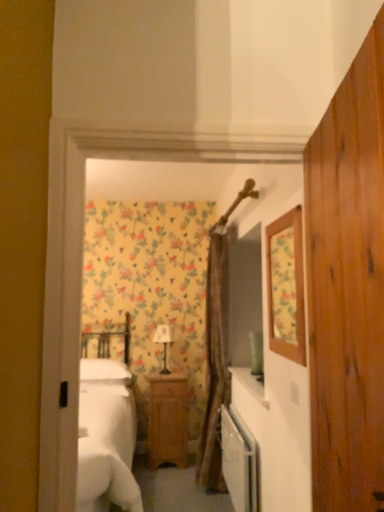
Locate an element on the screen. free space in front of wooden nightstand at center is located at coordinates click(x=152, y=478).